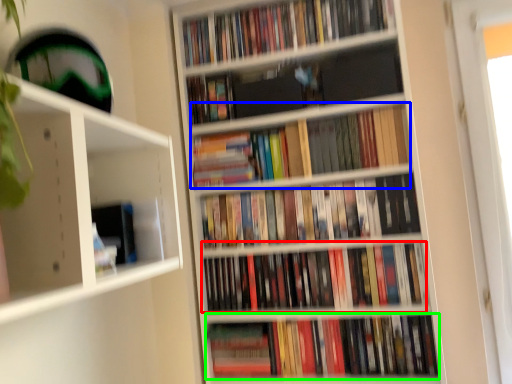
Question: Which is nearer to the book (highlighted by a red box)? book (highlighted by a blue box) or book (highlighted by a green box).

Choices:
 (A) book
 (B) book

Answer: (B)